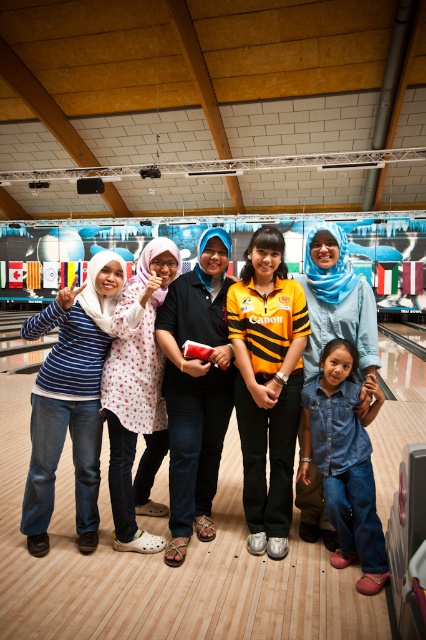
Question: Which object appears farthest from the camera in this image?

Choices:
 (A) denim jeans at center
 (B) denim jeans at lower right
 (C) black matte shirt at center

Answer: (C)

Question: Is black matte shirt at center further to camera compared to denim jeans at lower right?

Choices:
 (A) yes
 (B) no

Answer: (A)

Question: Is denim jeans at center below black matte shirt at center?

Choices:
 (A) yes
 (B) no

Answer: (A)

Question: Which point is closer to the camera?

Choices:
 (A) black matte shirt at center
 (B) denim jeans at center
 (C) denim jeans at lower right

Answer: (C)

Question: Which point appears closest to the camera in this image?

Choices:
 (A) (178, 284)
 (B) (345, 364)

Answer: (B)

Question: Does black matte shirt at center have a lesser width compared to denim jeans at lower right?

Choices:
 (A) yes
 (B) no

Answer: (B)